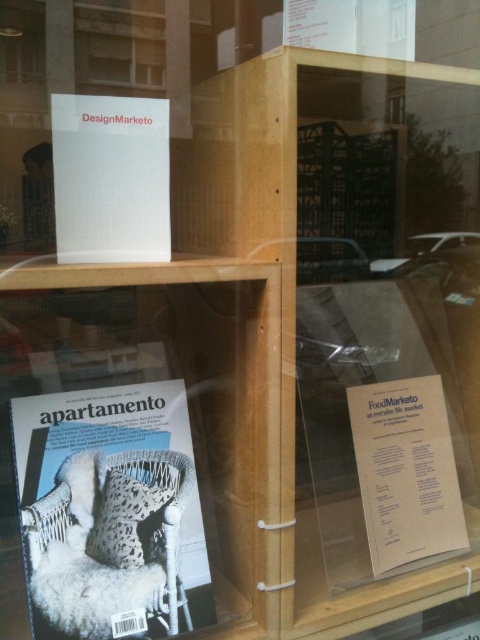
You are designing a layout for a new display case and want to place a new item between the white woven chair at lower left and the white paper at upper center. Based on their widths, which object should you place closer to the center to ensure the new item fits better?

The white woven chair at lower left might be wider than white paper at upper center, so placing the wider white woven chair at lower left closer to the center would allow the new item to fit better between them.

You are a customer looking to buy a chair for your living room. You see the white woven chair at lower left and the white paper at upper center in the display case. Which item is taller?

The white woven chair at lower left is taller than the white paper at upper center.

You are a customer standing in front of the display case. You want to take a photo of the white woven chair at lower left and the white paper at upper center. Which object will appear bigger in your photo?

The white woven chair at lower left will appear bigger in your photo because it is larger in size than the white paper at upper center.